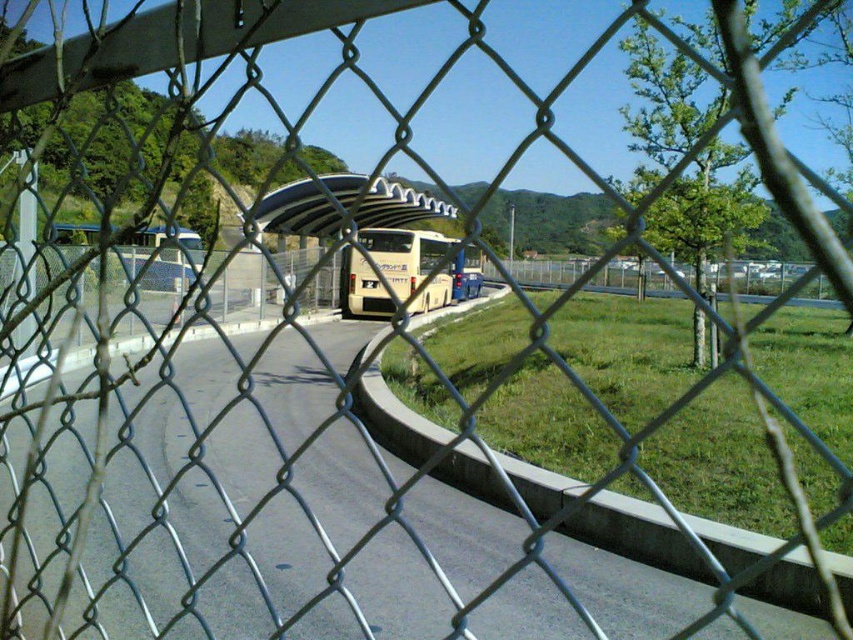
Can you confirm if beige plastic bus stop at center is positioned above beige matte bus at center?

Indeed, beige plastic bus stop at center is positioned over beige matte bus at center.

Describe the element at coordinates (341, 205) in the screenshot. I see `beige plastic bus stop at center` at that location.

Does point (351, 200) come closer to viewer compared to point (393, 285)?

No, it is behind (393, 285).

I want to click on beige plastic bus stop at center, so click(x=341, y=205).